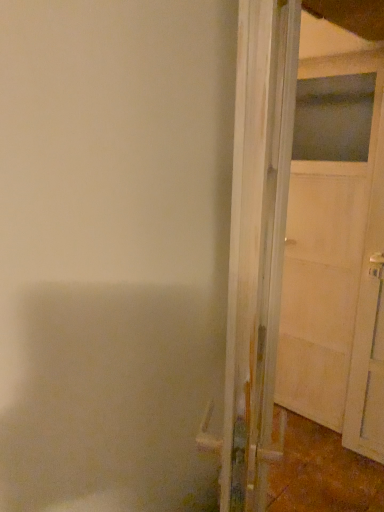
Question: Is white wood door at right, which is the 2th door from right to left, directly adjacent to white matte door at right, the second door when ordered from left to right?

Choices:
 (A) yes
 (B) no

Answer: (B)

Question: Does white wood door at right, which is the 2th door from right to left, come behind white matte door at right, which ranks as the first door in right-to-left order?

Choices:
 (A) yes
 (B) no

Answer: (B)

Question: Is white wood door at right, which is the first door in left-to-right order, oriented away from white matte door at right, which ranks as the first door in right-to-left order?

Choices:
 (A) yes
 (B) no

Answer: (B)

Question: Can you confirm if white wood door at right, which is the 2th door from right to left, is wider than white matte door at right, which ranks as the first door in right-to-left order?

Choices:
 (A) no
 (B) yes

Answer: (B)

Question: From a real-world perspective, does white wood door at right, which is the first door in left-to-right order, stand above white matte door at right, which ranks as the first door in right-to-left order?

Choices:
 (A) no
 (B) yes

Answer: (B)

Question: Are white wood door at right, which is the 2th door from right to left, and white matte door at right, which ranks as the first door in right-to-left order, located far from each other?

Choices:
 (A) yes
 (B) no

Answer: (A)

Question: Is white matte door at right, which ranks as the first door in right-to-left order, far from white wood door at right, which is the first door in left-to-right order?

Choices:
 (A) no
 (B) yes

Answer: (B)

Question: From a real-world perspective, does white matte door at right, which ranks as the first door in right-to-left order, stand above white wood door at right, which is the first door in left-to-right order?

Choices:
 (A) no
 (B) yes

Answer: (A)

Question: Is white matte door at right, the second door when ordered from left to right, smaller than white wood door at right, which is the first door in left-to-right order?

Choices:
 (A) no
 (B) yes

Answer: (B)

Question: Can you confirm if white matte door at right, the second door when ordered from left to right, is taller than white wood door at right, which is the first door in left-to-right order?

Choices:
 (A) no
 (B) yes

Answer: (B)

Question: Is white matte door at right, the second door when ordered from left to right, oriented away from white wood door at right, which is the first door in left-to-right order?

Choices:
 (A) yes
 (B) no

Answer: (A)

Question: Is white matte door at right, the second door when ordered from left to right, further to camera compared to white wood door at right, which is the 2th door from right to left?

Choices:
 (A) no
 (B) yes

Answer: (B)

Question: From a real-world perspective, is white matte door at right, the second door when ordered from left to right, positioned above or below white wood door at right, which is the 2th door from right to left?

Choices:
 (A) above
 (B) below

Answer: (B)